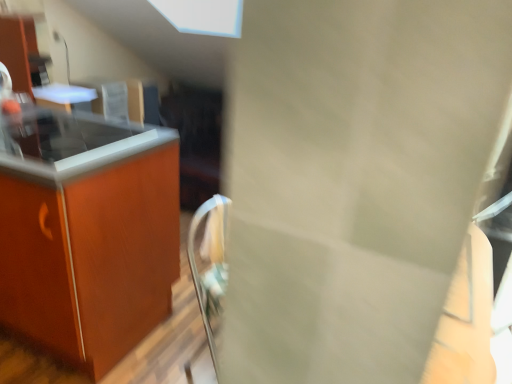
Question: From a real-world perspective, is matte wood countertop at left, acting as the first countertop starting from the bottom, on top of smooth glass countertop at left, acting as the second countertop starting from the bottom?

Choices:
 (A) yes
 (B) no

Answer: (B)

Question: Can you confirm if matte wood countertop at left, acting as the first countertop starting from the bottom, is positioned to the left of smooth glass countertop at left, acting as the second countertop starting from the bottom?

Choices:
 (A) no
 (B) yes

Answer: (B)

Question: Is the depth of matte wood countertop at left, the second countertop in the top-to-bottom sequence, greater than that of smooth glass countertop at left, acting as the second countertop starting from the bottom?

Choices:
 (A) yes
 (B) no

Answer: (B)

Question: Does matte wood countertop at left, the second countertop in the top-to-bottom sequence, contain smooth glass countertop at left, which appears as the 1th countertop when viewed from the top?

Choices:
 (A) no
 (B) yes

Answer: (B)

Question: From the image's perspective, does matte wood countertop at left, acting as the first countertop starting from the bottom, appear lower than smooth glass countertop at left, acting as the second countertop starting from the bottom?

Choices:
 (A) no
 (B) yes

Answer: (B)

Question: Would you consider matte wood countertop at left, the second countertop in the top-to-bottom sequence, to be distant from smooth glass countertop at left, acting as the second countertop starting from the bottom?

Choices:
 (A) no
 (B) yes

Answer: (A)

Question: Does smooth glass countertop at left, which appears as the 1th countertop when viewed from the top, have a greater width compared to matte wood countertop at left, the second countertop in the top-to-bottom sequence?

Choices:
 (A) yes
 (B) no

Answer: (B)

Question: From a real-world perspective, is smooth glass countertop at left, acting as the second countertop starting from the bottom, positioned over matte wood countertop at left, the second countertop in the top-to-bottom sequence, based on gravity?

Choices:
 (A) yes
 (B) no

Answer: (A)

Question: Could you tell me if smooth glass countertop at left, acting as the second countertop starting from the bottom, is turned towards matte wood countertop at left, acting as the first countertop starting from the bottom?

Choices:
 (A) yes
 (B) no

Answer: (A)

Question: Is smooth glass countertop at left, which appears as the 1th countertop when viewed from the top, positioned beyond the bounds of matte wood countertop at left, acting as the first countertop starting from the bottom?

Choices:
 (A) no
 (B) yes

Answer: (A)

Question: From the image's perspective, would you say smooth glass countertop at left, acting as the second countertop starting from the bottom, is shown under matte wood countertop at left, the second countertop in the top-to-bottom sequence?

Choices:
 (A) yes
 (B) no

Answer: (B)

Question: Is matte wood countertop at left, the second countertop in the top-to-bottom sequence, at the back of smooth glass countertop at left, acting as the second countertop starting from the bottom?

Choices:
 (A) yes
 (B) no

Answer: (A)

Question: Is point pyautogui.click(x=137, y=125) closer or farther from the camera than point pyautogui.click(x=110, y=193)?

Choices:
 (A) farther
 (B) closer

Answer: (A)